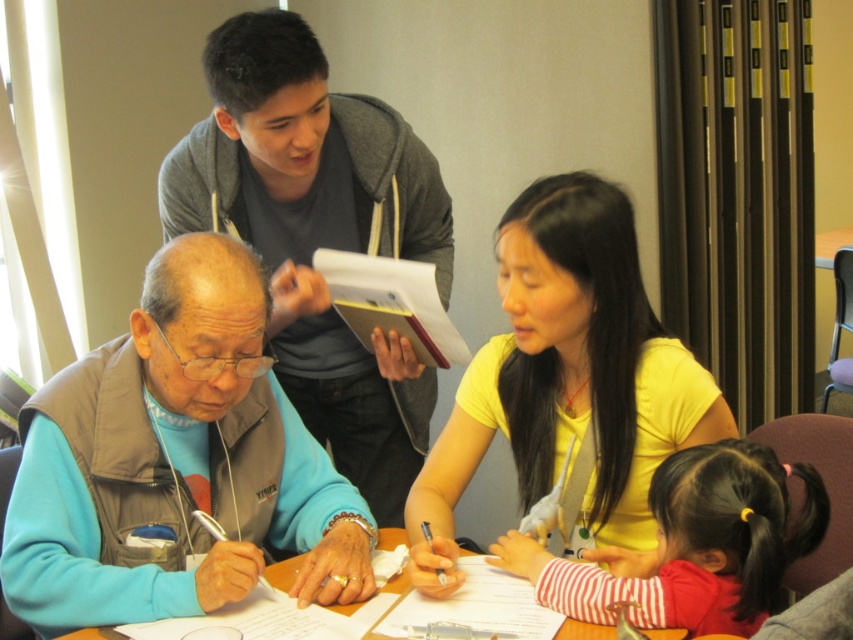
Is gray hoodie at upper center closer to the viewer compared to blue fleece vest at center?

No, it is not.

In order to click on gray hoodie at upper center in this screenshot , I will do `click(317, 234)`.

Describe the element at coordinates (317, 234) in the screenshot. I see `gray hoodie at upper center` at that location.

The image size is (853, 640). Find the location of `gray hoodie at upper center`. gray hoodie at upper center is located at coordinates (317, 234).

Who is higher up, blue fleece vest at center or striped fabric shirt at lower right?

blue fleece vest at center is higher up.

Find the location of a particular element. This screenshot has height=640, width=853. blue fleece vest at center is located at coordinates tap(241, 408).

Who is more forward, [151,572] or [680,595]?

Positioned in front is point [680,595].

Identify the location of blue fleece vest at center. This screenshot has width=853, height=640. (241, 408).

Does blue fleece vest at center have a lesser height compared to white paper at center?

Incorrect, blue fleece vest at center's height does not fall short of white paper at center's.

Is point (181, 328) closer to viewer compared to point (587, 634)?

No, it is not.

This screenshot has height=640, width=853. I want to click on blue fleece vest at center, so click(x=241, y=408).